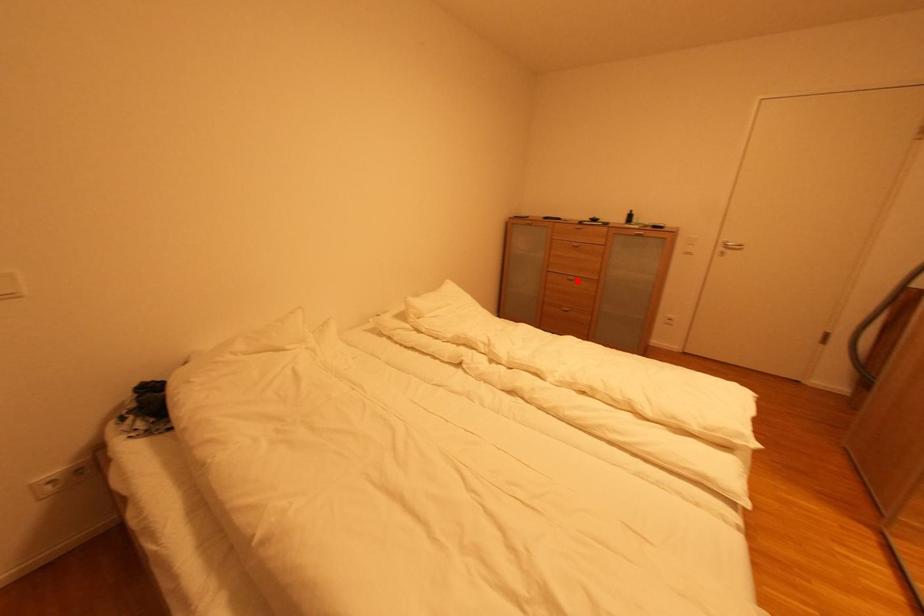
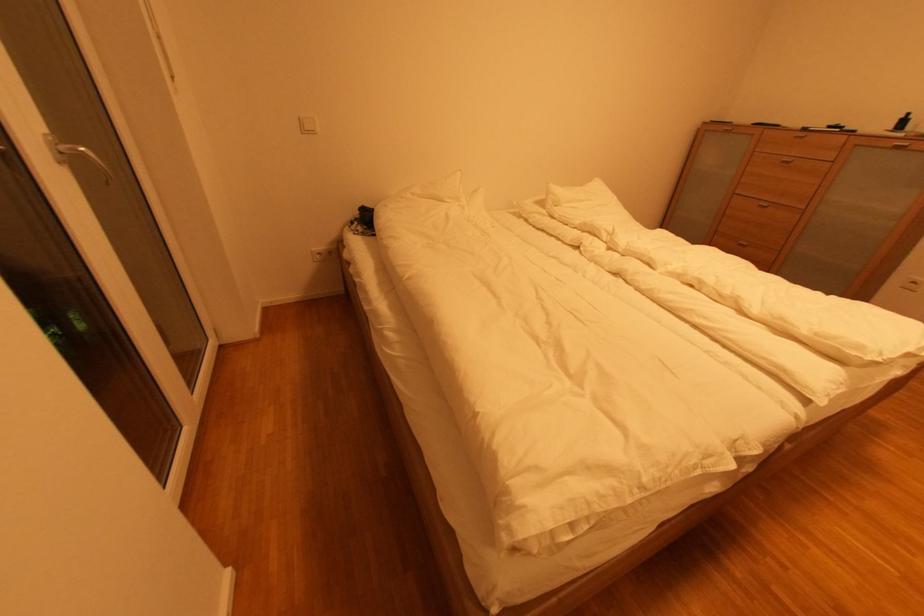
Where in the second image is the point corresponding to the highlighted location from the first image?

(772, 208)